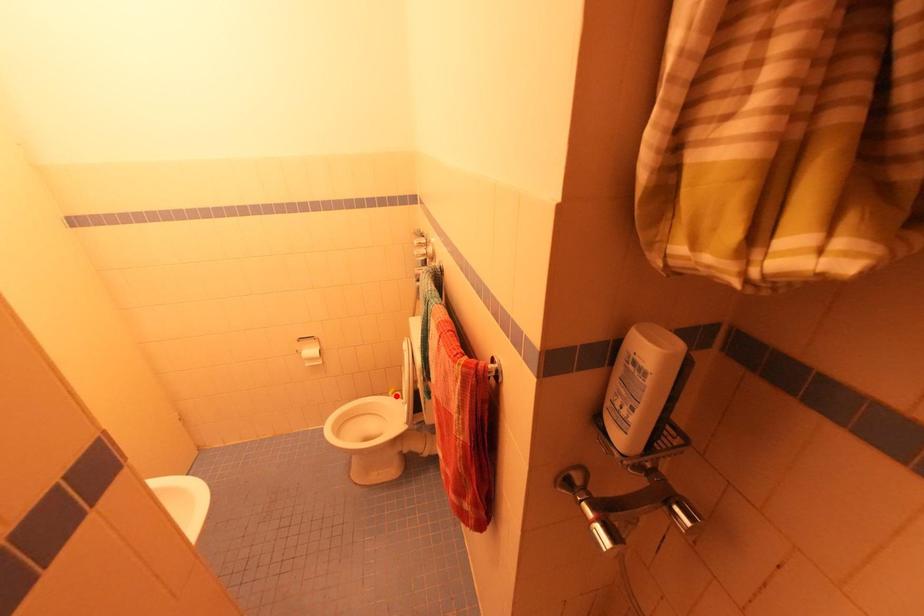
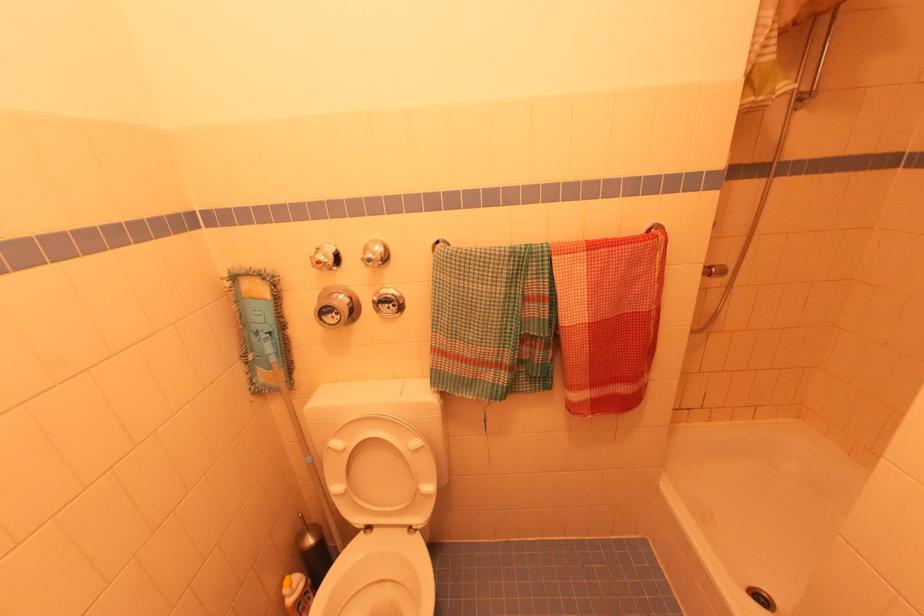
Locate, in the second image, the point that corresponds to the highlighted location in the first image.

(296, 585)